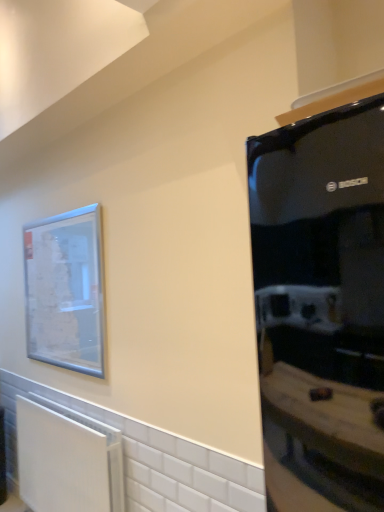
Question: Is there a large distance between white matte radiator at lower left and black glossy refrigerator at right?

Choices:
 (A) yes
 (B) no

Answer: (A)

Question: Can you confirm if white matte radiator at lower left is positioned to the left of black glossy refrigerator at right?

Choices:
 (A) yes
 (B) no

Answer: (A)

Question: From the image's perspective, does white matte radiator at lower left appear higher than black glossy refrigerator at right?

Choices:
 (A) no
 (B) yes

Answer: (A)

Question: Considering the relative sizes of white matte radiator at lower left and black glossy refrigerator at right in the image provided, is white matte radiator at lower left taller than black glossy refrigerator at right?

Choices:
 (A) no
 (B) yes

Answer: (A)

Question: Is white matte radiator at lower left oriented away from black glossy refrigerator at right?

Choices:
 (A) yes
 (B) no

Answer: (B)

Question: Is white matte radiator at lower left with black glossy refrigerator at right?

Choices:
 (A) yes
 (B) no

Answer: (B)

Question: Does clear glass picture frame at upper left have a greater height compared to white matte radiator at lower left?

Choices:
 (A) yes
 (B) no

Answer: (A)

Question: Can you confirm if clear glass picture frame at upper left is thinner than white matte radiator at lower left?

Choices:
 (A) no
 (B) yes

Answer: (B)

Question: Is clear glass picture frame at upper left to the right of white matte radiator at lower left from the viewer's perspective?

Choices:
 (A) no
 (B) yes

Answer: (A)

Question: Can you confirm if clear glass picture frame at upper left is bigger than white matte radiator at lower left?

Choices:
 (A) yes
 (B) no

Answer: (B)

Question: From the image's perspective, is clear glass picture frame at upper left on white matte radiator at lower left?

Choices:
 (A) yes
 (B) no

Answer: (A)

Question: Is clear glass picture frame at upper left not near white matte radiator at lower left?

Choices:
 (A) no
 (B) yes

Answer: (A)

Question: Does clear glass picture frame at upper left have a smaller size compared to black glossy refrigerator at right?

Choices:
 (A) yes
 (B) no

Answer: (A)